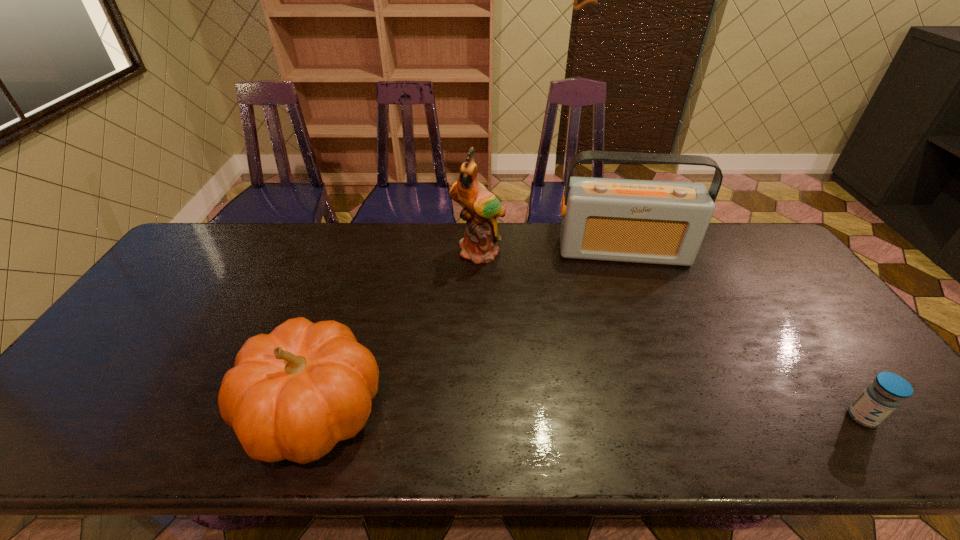
Locate an element on the screen. The height and width of the screenshot is (540, 960). vacant space at the far edge is located at coordinates (419, 244).

Locate an element on the screen. The image size is (960, 540). free space at the near edge is located at coordinates (818, 403).

The height and width of the screenshot is (540, 960). In the image, there is a desktop. Identify the location of free space at the left edge. (137, 322).

Where is `vacant region at the right edge of the desktop`? Image resolution: width=960 pixels, height=540 pixels. vacant region at the right edge of the desktop is located at coordinates (825, 319).

The height and width of the screenshot is (540, 960). In order to click on free region at the far left corner of the desktop in this screenshot , I will do `click(225, 258)`.

In the image, there is a desktop. Where is `vacant space at the far right corner`? vacant space at the far right corner is located at coordinates (718, 228).

Locate an element on the screen. The width and height of the screenshot is (960, 540). unoccupied area between the radio receiver and the third tallest object is located at coordinates (468, 331).

What are the coordinates of `vacant area that lies between the second shortest object and the second object from left to right` in the screenshot? It's located at (396, 332).

Find the location of a particular element. Image resolution: width=960 pixels, height=540 pixels. unoccupied area between the second object from left to right and the shortest object is located at coordinates (670, 335).

What are the coordinates of `vacant space in between the radio receiver and the second object from left to right` in the screenshot? It's located at (551, 252).